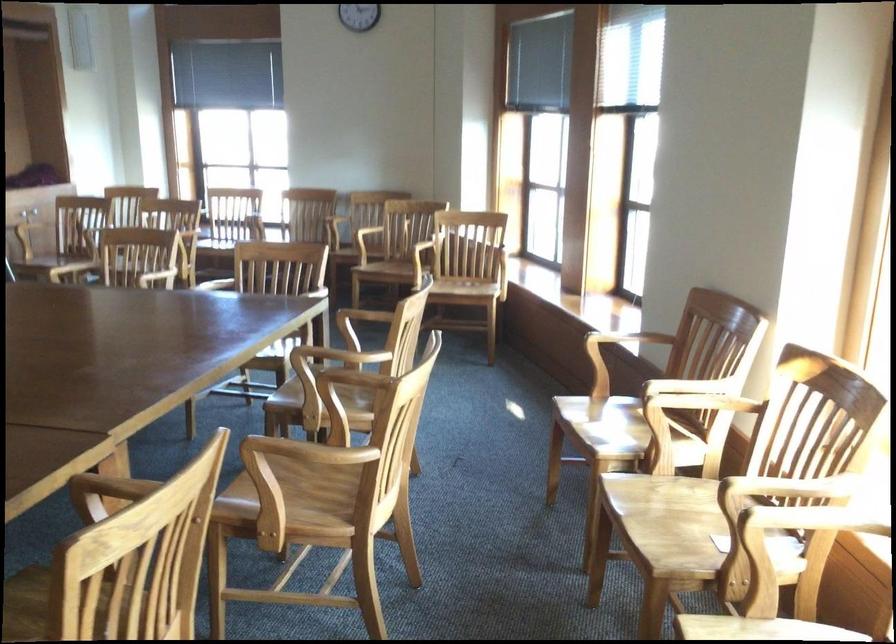
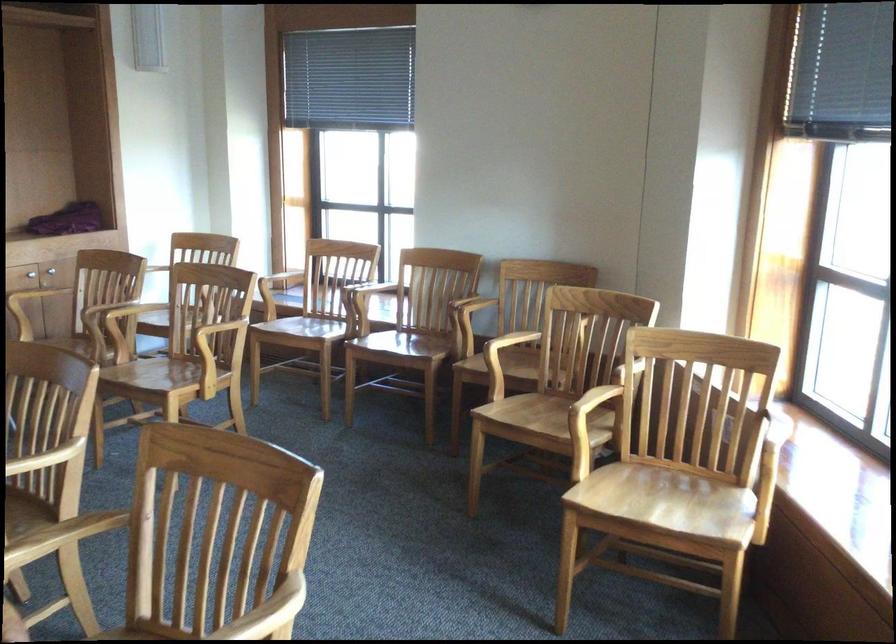
In the second image, find the point that corresponds to (x=297, y=290) in the first image.

(268, 612)